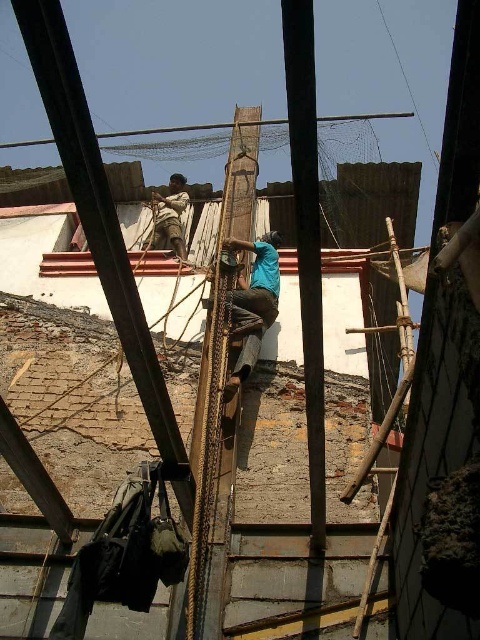
Question: Is blue fabric construction worker at center positioned before bamboo ladder at center?

Choices:
 (A) yes
 (B) no

Answer: (B)

Question: Which point is closer to the camera?

Choices:
 (A) blue fabric construction worker at center
 (B) smooth wood pole at center

Answer: (B)

Question: Is blue fabric construction worker at center to the left of bamboo ladder at center from the viewer's perspective?

Choices:
 (A) no
 (B) yes

Answer: (B)

Question: Which object is positioned farthest from the smooth wood pole at center?

Choices:
 (A) bamboo ladder at center
 (B) blue fabric construction worker at center
 (C) light brown fabric at upper center

Answer: (C)

Question: Can you confirm if smooth wood pole at center is bigger than bamboo ladder at center?

Choices:
 (A) yes
 (B) no

Answer: (B)

Question: Among these points, which one is nearest to the camera?

Choices:
 (A) (304, 216)
 (B) (155, 198)
 (C) (231, 310)

Answer: (A)